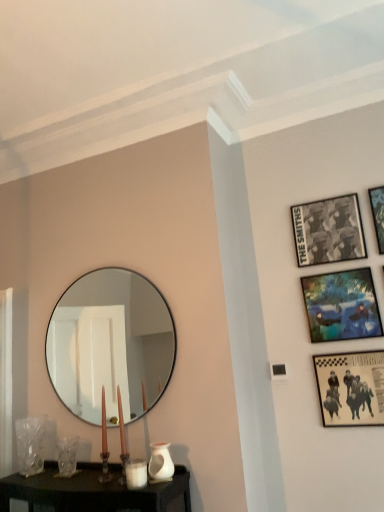
This screenshot has height=512, width=384. Describe the element at coordinates (341, 305) in the screenshot. I see `blue fabric painting at upper right, which is the 2th picture frame in bottom-to-top order` at that location.

Where is `white matte candle holder at lower center`? Image resolution: width=384 pixels, height=512 pixels. white matte candle holder at lower center is located at coordinates (136, 473).

What do you see at coordinates (136, 473) in the screenshot?
I see `white matte candle holder at lower center` at bounding box center [136, 473].

This screenshot has width=384, height=512. What do you see at coordinates (378, 214) in the screenshot?
I see `metallic silver picture frame at upper right, the fourth picture frame ordered from the bottom` at bounding box center [378, 214].

Measure the distance between black glass mirror at upper center and camera.

black glass mirror at upper center is 1.94 meters away from camera.

What do you see at coordinates (328, 231) in the screenshot? The image size is (384, 512). I see `black paper picture frame at upper right, positioned as the 2th picture frame in top-to-bottom order` at bounding box center [328, 231].

The height and width of the screenshot is (512, 384). Describe the element at coordinates (160, 462) in the screenshot. I see `white glossy vase at lower center` at that location.

You are a GUI agent. You are given a task and a screenshot of the screen. Output one action in this format:
    pyautogui.click(x=<x>, y=<y>)
    Task: Click on the matte black picture frame at lower right, which is the first picture frame in bottom-to-top order
    This screenshot has width=384, height=512.
    Given the screenshot: What is the action you would take?
    pyautogui.click(x=351, y=387)

At what (x,y) coordinates should I click in order to perform the action: click on candle holder located on the left of blue fabric painting at upper right, positioned as the third picture frame in top-to-bottom order. Please return your answer as a coordinate pair (x, y). Image resolution: width=384 pixels, height=512 pixels. Looking at the image, I should click on (136, 473).

From the image's perspective, is white matte candle holder at lower center located beneath blue fabric painting at upper right, positioned as the third picture frame in top-to-bottom order?

Correct, white matte candle holder at lower center appears lower than blue fabric painting at upper right, positioned as the third picture frame in top-to-bottom order, in the image.

Is white matte candle holder at lower center wider or thinner than blue fabric painting at upper right, which is the 2th picture frame in bottom-to-top order?

Clearly, white matte candle holder at lower center has more width compared to blue fabric painting at upper right, which is the 2th picture frame in bottom-to-top order.

Can you confirm if white matte candle holder at lower center is positioned to the left of blue fabric painting at upper right, which is the 2th picture frame in bottom-to-top order?

Yes, white matte candle holder at lower center is to the left of blue fabric painting at upper right, which is the 2th picture frame in bottom-to-top order.

Is there a large distance between black paper picture frame at upper right, positioned as the 2th picture frame in top-to-bottom order, and matte black picture frame at lower right, which is the first picture frame in bottom-to-top order?

black paper picture frame at upper right, positioned as the 2th picture frame in top-to-bottom order, is actually quite close to matte black picture frame at lower right, which is the first picture frame in bottom-to-top order.

Considering the relative positions of black paper picture frame at upper right, positioned as the 2th picture frame in top-to-bottom order, and matte black picture frame at lower right, which is the first picture frame in bottom-to-top order, in the image provided, is black paper picture frame at upper right, positioned as the 2th picture frame in top-to-bottom order, in front of matte black picture frame at lower right, which is the first picture frame in bottom-to-top order,?

That is False.

Which object is thinner, black paper picture frame at upper right, the third picture frame in the bottom-to-top sequence, or matte black picture frame at lower right, which is the first picture frame in bottom-to-top order?

Thinner between the two is black paper picture frame at upper right, the third picture frame in the bottom-to-top sequence.

Could you tell me if black paper picture frame at upper right, the third picture frame in the bottom-to-top sequence, is turned towards matte black picture frame at lower right, the 4th picture frame from the top?

No, black paper picture frame at upper right, the third picture frame in the bottom-to-top sequence, is not facing towards matte black picture frame at lower right, the 4th picture frame from the top.

From a real-world perspective, relative to blue fabric painting at upper right, positioned as the third picture frame in top-to-bottom order, is black paper picture frame at upper right, positioned as the 2th picture frame in top-to-bottom order, vertically above or below?

black paper picture frame at upper right, positioned as the 2th picture frame in top-to-bottom order, is situated higher than blue fabric painting at upper right, positioned as the third picture frame in top-to-bottom order, in the real world.

Considering their positions, is black paper picture frame at upper right, positioned as the 2th picture frame in top-to-bottom order, located in front of or behind blue fabric painting at upper right, which is the 2th picture frame in bottom-to-top order?

Clearly, black paper picture frame at upper right, positioned as the 2th picture frame in top-to-bottom order, is behind blue fabric painting at upper right, which is the 2th picture frame in bottom-to-top order.

Between black paper picture frame at upper right, positioned as the 2th picture frame in top-to-bottom order, and blue fabric painting at upper right, positioned as the third picture frame in top-to-bottom order, which one has larger size?

With larger size is blue fabric painting at upper right, positioned as the third picture frame in top-to-bottom order.

Is black paper picture frame at upper right, positioned as the 2th picture frame in top-to-bottom order, shorter than blue fabric painting at upper right, positioned as the third picture frame in top-to-bottom order?

Indeed, black paper picture frame at upper right, positioned as the 2th picture frame in top-to-bottom order, has a lesser height compared to blue fabric painting at upper right, positioned as the third picture frame in top-to-bottom order.

Which of these two, white matte candle holder at lower center or white glossy vase at lower center, is bigger?

With larger size is white glossy vase at lower center.

Is white matte candle holder at lower center facing away from white glossy vase at lower center?

That's right, white matte candle holder at lower center is facing away from white glossy vase at lower center.

Measure the distance between white matte candle holder at lower center and white glossy vase at lower center.

white matte candle holder at lower center is 3.14 inches away from white glossy vase at lower center.

Considering the sizes of objects white matte candle holder at lower center and white glossy vase at lower center in the image provided, who is thinner, white matte candle holder at lower center or white glossy vase at lower center?

With smaller width is white matte candle holder at lower center.

From a real-world perspective, count 3rd picture frames upward from the black glass mirror at upper center and point to it. Please provide its 2D coordinates.

[(378, 214)]

Could you tell me if black glass mirror at upper center is facing metallic silver picture frame at upper right, the fourth picture frame ordered from the bottom?

No, black glass mirror at upper center does not turn towards metallic silver picture frame at upper right, the fourth picture frame ordered from the bottom.

Between black glass mirror at upper center and metallic silver picture frame at upper right, which is the 1th picture frame from top to bottom, which one appears on the left side from the viewer's perspective?

black glass mirror at upper center is more to the left.

Could metallic silver picture frame at upper right, which is the 1th picture frame from top to bottom, be considered to be inside black glass mirror at upper center?

Actually, metallic silver picture frame at upper right, which is the 1th picture frame from top to bottom, is outside black glass mirror at upper center.

Considering the sizes of metallic silver picture frame at upper right, the fourth picture frame ordered from the bottom, and blue fabric painting at upper right, which is the 2th picture frame in bottom-to-top order, in the image, is metallic silver picture frame at upper right, the fourth picture frame ordered from the bottom, taller or shorter than blue fabric painting at upper right, which is the 2th picture frame in bottom-to-top order,?

Considering their sizes, metallic silver picture frame at upper right, the fourth picture frame ordered from the bottom, has more height than blue fabric painting at upper right, which is the 2th picture frame in bottom-to-top order.

Is blue fabric painting at upper right, which is the 2th picture frame in bottom-to-top order, inside metallic silver picture frame at upper right, which is the 1th picture frame from top to bottom?

Definitely not — blue fabric painting at upper right, which is the 2th picture frame in bottom-to-top order, is not inside metallic silver picture frame at upper right, which is the 1th picture frame from top to bottom.

Is point (379, 205) more distant than point (311, 315)?

No, (379, 205) is in front of (311, 315).

Measure the distance between metallic silver picture frame at upper right, the fourth picture frame ordered from the bottom, and blue fabric painting at upper right, which is the 2th picture frame in bottom-to-top order.

A distance of 32.48 centimeters exists between metallic silver picture frame at upper right, the fourth picture frame ordered from the bottom, and blue fabric painting at upper right, which is the 2th picture frame in bottom-to-top order.

From the image's perspective, relative to black paper picture frame at upper right, the third picture frame in the bottom-to-top sequence, is blue fabric painting at upper right, positioned as the third picture frame in top-to-bottom order, above or below?

Clearly, from the image's perspective, blue fabric painting at upper right, positioned as the third picture frame in top-to-bottom order, is below black paper picture frame at upper right, the third picture frame in the bottom-to-top sequence.

Could you tell me if blue fabric painting at upper right, which is the 2th picture frame in bottom-to-top order, is turned towards black paper picture frame at upper right, the third picture frame in the bottom-to-top sequence?

No, blue fabric painting at upper right, which is the 2th picture frame in bottom-to-top order, is not facing towards black paper picture frame at upper right, the third picture frame in the bottom-to-top sequence.

Is the depth of blue fabric painting at upper right, which is the 2th picture frame in bottom-to-top order, greater than that of black paper picture frame at upper right, the third picture frame in the bottom-to-top sequence?

No, the depth of blue fabric painting at upper right, which is the 2th picture frame in bottom-to-top order, is less than that of black paper picture frame at upper right, the third picture frame in the bottom-to-top sequence.

In the scene shown: How many degrees apart are the facing directions of blue fabric painting at upper right, positioned as the third picture frame in top-to-bottom order, and black paper picture frame at upper right, positioned as the 2th picture frame in top-to-bottom order?

blue fabric painting at upper right, positioned as the third picture frame in top-to-bottom order, and black paper picture frame at upper right, positioned as the 2th picture frame in top-to-bottom order, are facing 0.293 degrees away from each other.

Where is `the 3rd picture frame behind the white matte candle holder at lower center`? The height and width of the screenshot is (512, 384). the 3rd picture frame behind the white matte candle holder at lower center is located at coordinates (341, 305).

Locate an element on the screen. This screenshot has height=512, width=384. the 3rd picture frame in front of the black paper picture frame at upper right, the third picture frame in the bottom-to-top sequence is located at coordinates (351, 387).

Which object lies nearer to the anchor point black paper picture frame at upper right, positioned as the 2th picture frame in top-to-bottom order, blue fabric painting at upper right, which is the 2th picture frame in bottom-to-top order, or clear glass vase at lower left?

blue fabric painting at upper right, which is the 2th picture frame in bottom-to-top order, lies closer to black paper picture frame at upper right, positioned as the 2th picture frame in top-to-bottom order, than the other object.

From the image, which object appears to be nearer to black paper picture frame at upper right, positioned as the 2th picture frame in top-to-bottom order, white matte candle holder at lower center or clear glass vase at lower left?

white matte candle holder at lower center is closer to black paper picture frame at upper right, positioned as the 2th picture frame in top-to-bottom order.

From the image, which object appears to be nearer to white matte candle holder at lower center, blue fabric painting at upper right, which is the 2th picture frame in bottom-to-top order, or metallic silver picture frame at upper right, the fourth picture frame ordered from the bottom?

blue fabric painting at upper right, which is the 2th picture frame in bottom-to-top order, lies closer to white matte candle holder at lower center than the other object.

From the picture: Based on their spatial positions, is white matte candle holder at lower center or matte black picture frame at lower right, which is the first picture frame in bottom-to-top order, closer to black paper picture frame at upper right, positioned as the 2th picture frame in top-to-bottom order?

Based on the image, matte black picture frame at lower right, which is the first picture frame in bottom-to-top order, appears to be nearer to black paper picture frame at upper right, positioned as the 2th picture frame in top-to-bottom order.

Based on their spatial positions, is metallic silver picture frame at upper right, which is the 1th picture frame from top to bottom, or black paper picture frame at upper right, positioned as the 2th picture frame in top-to-bottom order, further from white matte candle holder at lower center?

metallic silver picture frame at upper right, which is the 1th picture frame from top to bottom.

When comparing their distances from white matte candle holder at lower center, does black glass mirror at upper center or white glossy vase at lower center seem further?

black glass mirror at upper center is positioned further to the anchor white matte candle holder at lower center.

Which object lies nearer to the anchor point metallic silver picture frame at upper right, which is the 1th picture frame from top to bottom, clear glass vase at lower left or blue fabric painting at upper right, positioned as the third picture frame in top-to-bottom order?

The object closer to metallic silver picture frame at upper right, which is the 1th picture frame from top to bottom, is blue fabric painting at upper right, positioned as the third picture frame in top-to-bottom order.

Considering their positions, is matte black picture frame at lower right, the 4th picture frame from the top, positioned further to white glossy vase at lower center than white matte candle holder at lower center?

matte black picture frame at lower right, the 4th picture frame from the top.

Where is `vase between clear glass vase at lower left and metallic silver picture frame at upper right, the fourth picture frame ordered from the bottom`? Image resolution: width=384 pixels, height=512 pixels. vase between clear glass vase at lower left and metallic silver picture frame at upper right, the fourth picture frame ordered from the bottom is located at coordinates (160, 462).

The width and height of the screenshot is (384, 512). In order to click on vase between black glass mirror at upper center and metallic silver picture frame at upper right, the fourth picture frame ordered from the bottom, in the horizontal direction in this screenshot , I will do `click(160, 462)`.

Identify the location of candle holder between black glass mirror at upper center and matte black picture frame at lower right, which is the first picture frame in bottom-to-top order, in the horizontal direction. (136, 473).

Locate an element on the screen. Image resolution: width=384 pixels, height=512 pixels. vase located between white matte candle holder at lower center and blue fabric painting at upper right, positioned as the third picture frame in top-to-bottom order, in the left-right direction is located at coordinates (160, 462).